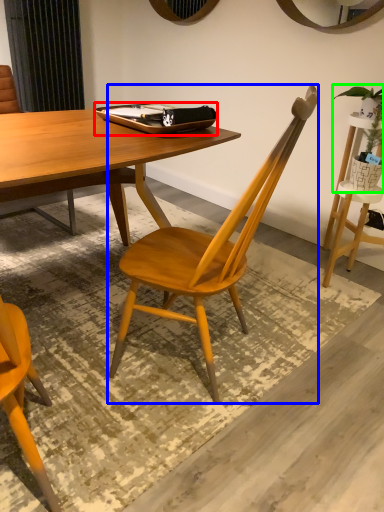
Question: Considering the real-world distances, which object is farthest from tray (highlighted by a red box)? chair (highlighted by a blue box) or houseplant (highlighted by a green box)?

Choices:
 (A) chair
 (B) houseplant

Answer: (B)